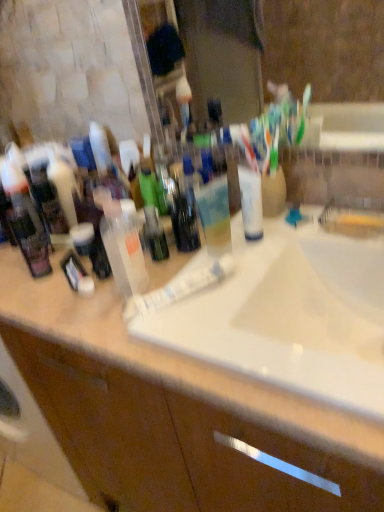
The width and height of the screenshot is (384, 512). Find the location of `vacant space in front of black matte toothbrush at left, marked as the third toiletry in a left-to-right arrangement`. vacant space in front of black matte toothbrush at left, marked as the third toiletry in a left-to-right arrangement is located at coordinates (80, 314).